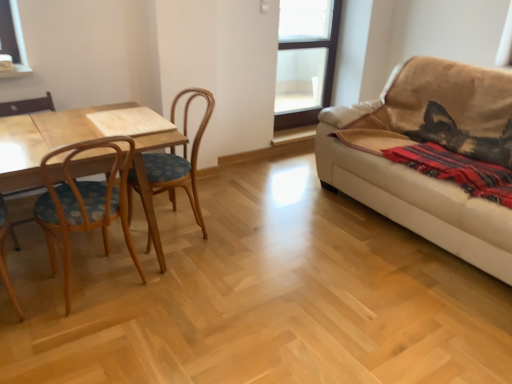
Locate an element on the screen. woodenchair at left is located at coordinates (180, 160).

What is the approximate width of woodenchair at left?

55.44 centimeters.

The width and height of the screenshot is (512, 384). What do you see at coordinates (416, 171) in the screenshot?
I see `beige fabric couch at right` at bounding box center [416, 171].

This screenshot has width=512, height=384. I want to click on wooden table at left, so click(83, 140).

What do you see at coordinates (308, 69) in the screenshot? I see `transparent glass window at upper center` at bounding box center [308, 69].

What is the approximate height of wooden chair at left?

wooden chair at left is 33.63 inches tall.

Find the location of a particular element. woodenchair at left is located at coordinates (180, 160).

Between wooden chair at left and red woven blanket at right, which one appears on the right side from the viewer's perspective?

red woven blanket at right.

Which is correct: wooden chair at left is inside red woven blanket at right, or outside of it?

wooden chair at left exists outside the volume of red woven blanket at right.

Is wooden chair at left directly adjacent to red woven blanket at right?

No.

From the image's perspective, is transparent glass window at upper center above wooden chair at left?

Yes, from the image's perspective, transparent glass window at upper center is above wooden chair at left.

Is transparent glass window at upper center far away from wooden chair at left?

transparent glass window at upper center is far away from wooden chair at left.

Looking at this image, between transparent glass window at upper center and wooden chair at left, which one has larger width?

wooden chair at left is wider.

Between transparent glass window at upper center and wooden chair at left, which one has less height?

wooden chair at left.

From a real-world perspective, is red woven blanket at right above or below beige fabric couch at right?

From a real-world perspective, red woven blanket at right is physically above beige fabric couch at right.

Which is correct: red woven blanket at right is inside beige fabric couch at right, or outside of it?

red woven blanket at right is inside beige fabric couch at right.

Between red woven blanket at right and beige fabric couch at right, which one is positioned in front?

beige fabric couch at right is more forward.

Is point (490, 197) closer or farther from the camera than point (472, 216)?

Point (490, 197) is closer to the camera than point (472, 216).

What's the angular difference between wooden table at left and wooden chair at left's facing directions?

The angular difference between wooden table at left and wooden chair at left is 179 degrees.

Is wooden chair at left a part of wooden table at left?

Yes, wooden chair at left is surrounded by wooden table at left.

Which is farther from the camera, (24, 141) or (51, 103)?

The point (51, 103) is more distant.

Find the location of a particular element. The image size is (512, 384). armchair above the wooden table at left (from a real-world perspective) is located at coordinates click(27, 106).

Does woodenchair at left have a larger size compared to beige fabric couch at right?

Actually, woodenchair at left might be smaller than beige fabric couch at right.

From a real-world perspective, is woodenchair at left positioned above or below beige fabric couch at right?

woodenchair at left is situated lower than beige fabric couch at right in the real world.

At what (x,y) coordinates should I click in order to perform the action: click on chair beneath the beige fabric couch at right (from a real-world perspective). Please return your answer as a coordinate pair (x, y). Image resolution: width=512 pixels, height=384 pixels. Looking at the image, I should click on (180, 160).

Visually, is woodenchair at left positioned to the left or to the right of beige fabric couch at right?

Clearly, woodenchair at left is on the left of beige fabric couch at right in the image.

Relative to wooden table at left, is transparent glass window at upper center in front or behind?

Clearly, transparent glass window at upper center is behind wooden table at left.

From a real-world perspective, which object stands above the other?

transparent glass window at upper center.

Does transparent glass window at upper center appear on the right side of wooden table at left?

Indeed, transparent glass window at upper center is positioned on the right side of wooden table at left.

Is transparent glass window at upper center outside of wooden table at left?

transparent glass window at upper center lies outside wooden table at left's area.

From a real-world perspective, is red woven blanket at right on top of transparent glass window at upper center?

No, from a real-world perspective, red woven blanket at right is not over transparent glass window at upper center

Do you think red woven blanket at right is within transparent glass window at upper center, or outside of it?

red woven blanket at right is not inside transparent glass window at upper center, it's outside.

Is red woven blanket at right taller than transparent glass window at upper center?

No.

Measure the distance from red woven blanket at right to transparent glass window at upper center.

The distance of red woven blanket at right from transparent glass window at upper center is 6.58 feet.

You are a GUI agent. You are given a task and a screenshot of the screen. Output one action in this format:
    pyautogui.click(x=<x>, y=<y>)
    Task: Click on the blanket that appears above the wooden chair at left (from the image's perspective)
    
    Given the screenshot: What is the action you would take?
    tap(456, 170)

Image resolution: width=512 pixels, height=384 pixels. I want to click on window behind the wooden chair at left, so click(x=308, y=69).

Estimate the real-world distances between objects in this image. Which object is closer to wooden table at left, red woven blanket at right or wooden chair at left?

Based on the image, wooden chair at left appears to be nearer to wooden table at left.

Looking at the image, which one is located further to transparent glass window at upper center, red woven blanket at right or wooden chair at left?

wooden chair at left lies further to transparent glass window at upper center than the other object.

From the image, which object appears to be nearer to transparent glass window at upper center, wooden chair at left or woodenchair at left?

The object closer to transparent glass window at upper center is woodenchair at left.

Estimate the real-world distances between objects in this image. Which object is further from wooden table at left, red woven blanket at right or transparent glass window at upper center?

The object further to wooden table at left is transparent glass window at upper center.

Based on their spatial positions, is transparent glass window at upper center or beige fabric couch at right closer to wooden table at left?

The object closer to wooden table at left is beige fabric couch at right.

From the image, which object appears to be farther from woodenchair at left, wooden table at left or wooden chair at left?

Among the two, wooden chair at left is located further to woodenchair at left.

From the picture: When comparing their distances from woodenchair at left, does beige fabric couch at right or red woven blanket at right seem further?

The object further to woodenchair at left is red woven blanket at right.

Which object lies further to the anchor point transparent glass window at upper center, red woven blanket at right or woodenchair at left?

red woven blanket at right.

The height and width of the screenshot is (384, 512). In order to click on chair between wooden table at left and beige fabric couch at right from left to right in this screenshot , I will do `click(180, 160)`.

Locate an element on the screen. blanket located between woodenchair at left and beige fabric couch at right in the left-right direction is located at coordinates (456, 170).

Where is `table located between wooden chair at left and red woven blanket at right in the left-right direction`? table located between wooden chair at left and red woven blanket at right in the left-right direction is located at coordinates (83, 140).

The image size is (512, 384). I want to click on studio couch located between wooden table at left and transparent glass window at upper center in the depth direction, so click(416, 171).